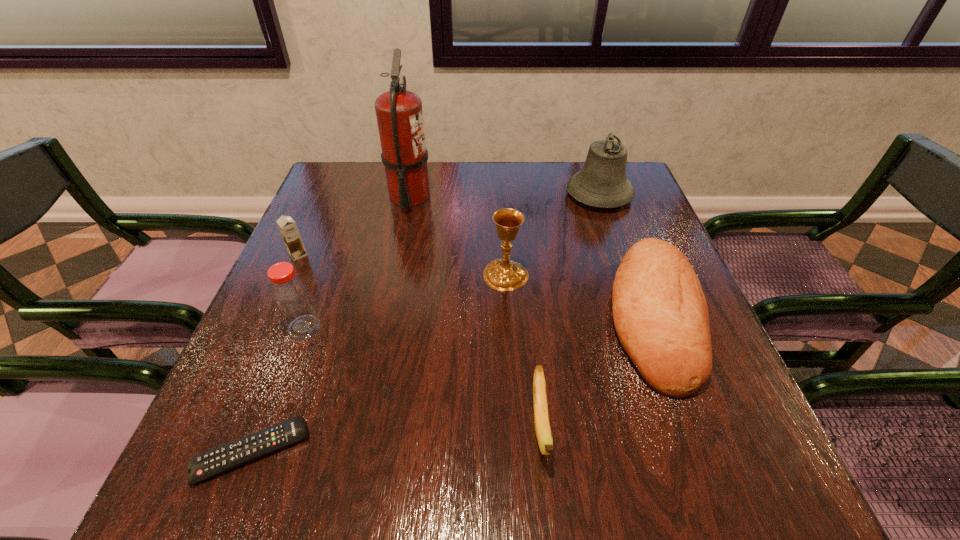
This screenshot has height=540, width=960. What are the coordinates of `bottle that is positioned at the left edge` in the screenshot? It's located at (291, 297).

Image resolution: width=960 pixels, height=540 pixels. What are the coordinates of `chocolate milk present at the left edge` in the screenshot? It's located at (287, 226).

I want to click on remote control located at the left edge, so 225,457.

This screenshot has height=540, width=960. Identify the location of bell present at the right edge. (602, 182).

Find the location of a particular element. This screenshot has height=540, width=960. bread that is at the right edge is located at coordinates (660, 313).

You are a GUI agent. You are given a task and a screenshot of the screen. Output one action in this format:
    pyautogui.click(x=<x>, y=<y>)
    Task: Click on the object present at the near left corner
    
    Given the screenshot: What is the action you would take?
    pyautogui.click(x=225, y=457)

Locate an element on the screen. The height and width of the screenshot is (540, 960). object that is at the far right corner is located at coordinates (602, 182).

You are a GUI agent. You are given a task and a screenshot of the screen. Output one action in this format:
    pyautogui.click(x=<x>, y=<y>)
    Task: Click on the vacant space at the far edge of the desktop
    The height and width of the screenshot is (540, 960).
    Given the screenshot: What is the action you would take?
    pyautogui.click(x=450, y=198)

At what (x,y) coordinates should I click in order to perform the action: click on free region at the near edge of the desktop. Please return your answer as a coordinate pair (x, y). This screenshot has width=960, height=540. Looking at the image, I should click on (339, 457).

Find the location of a particular element. This screenshot has height=540, width=960. free location at the left edge of the desktop is located at coordinates (312, 226).